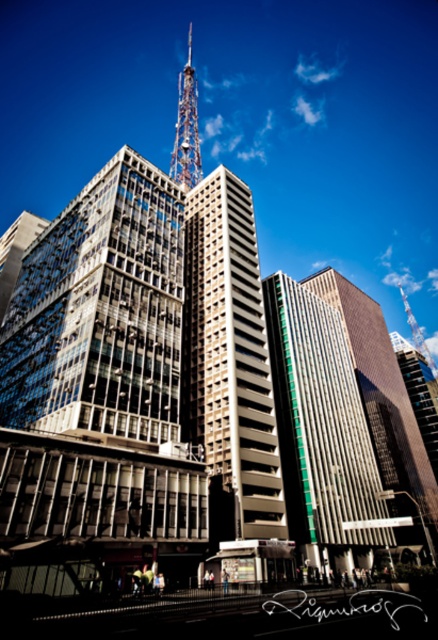
Who is more distant from viewer, [260,296] or [176,157]?

Point [176,157]

From the picture: Which is more to the right, metallic glass skyscraper at center or metallic lattice tower at upper center?

Positioned to the right is metallic glass skyscraper at center.

Measure the distance between metallic glass skyscraper at center and camera.

metallic glass skyscraper at center and camera are 52.80 meters apart from each other.

Where is `metallic glass skyscraper at center`? This screenshot has width=438, height=640. metallic glass skyscraper at center is located at coordinates (229, 362).

Which is more to the right, green glass building at center or metallic lattice tower at upper center?

Positioned to the right is green glass building at center.

Can you confirm if green glass building at center is shorter than metallic lattice tower at upper center?

Yes, green glass building at center is shorter than metallic lattice tower at upper center.

Does point (374, 547) come farther from viewer compared to point (184, 147)?

That is False.

At what (x,y) coordinates should I click in order to perform the action: click on green glass building at center. Please return your answer as a coordinate pair (x, y). This screenshot has width=438, height=640. Looking at the image, I should click on (321, 429).

Can you confirm if metallic glass skyscraper at center is smaller than green glass building at center?

Yes.

In the scene shown: Is metallic glass skyscraper at center above green glass building at center?

Yes.

Is point (233, 428) closer to camera compared to point (314, 545)?

Yes, point (233, 428) is in front of point (314, 545).

Identify the location of metallic glass skyscraper at center. The width and height of the screenshot is (438, 640). (229, 362).